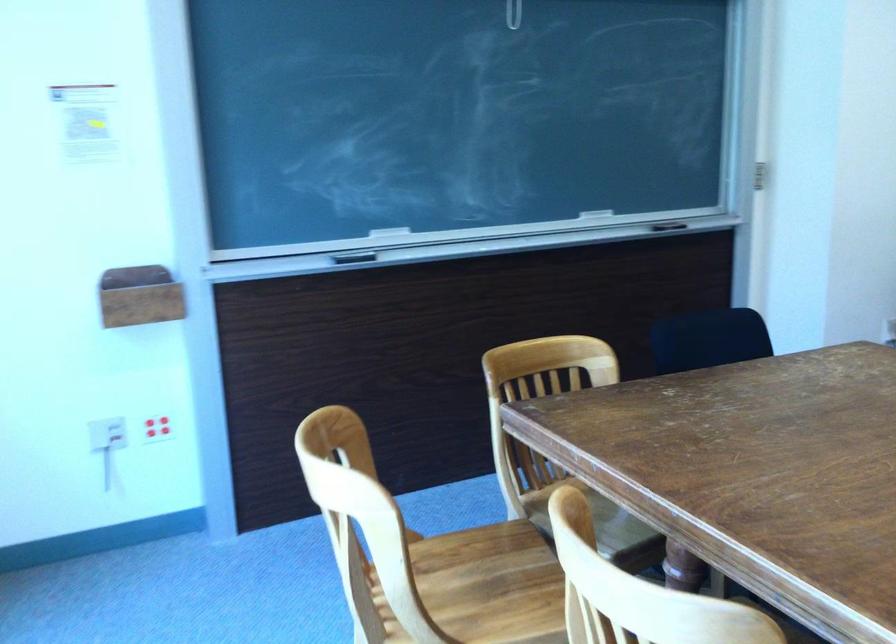
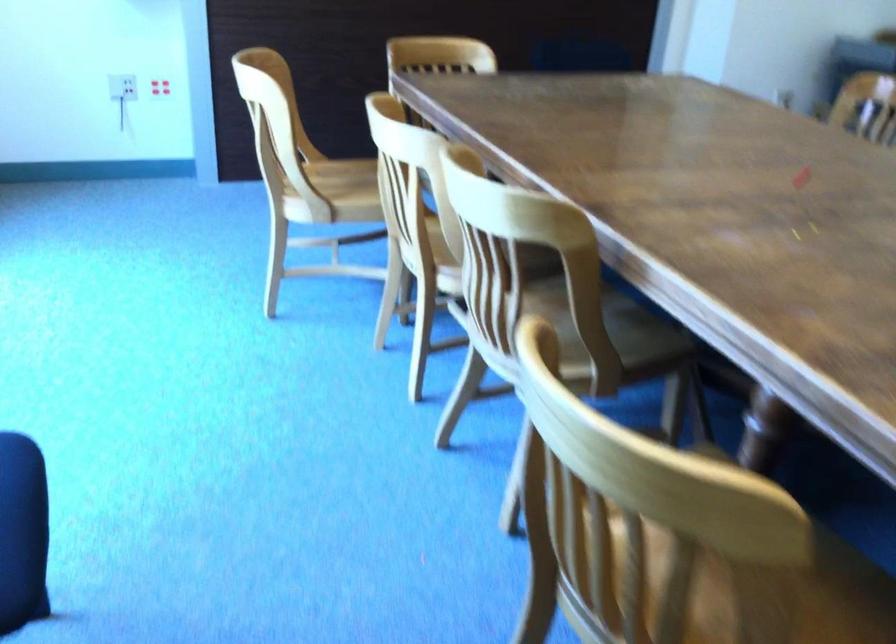
In the second image, find the point that corresponds to pixel 106 442 in the first image.

(122, 87)